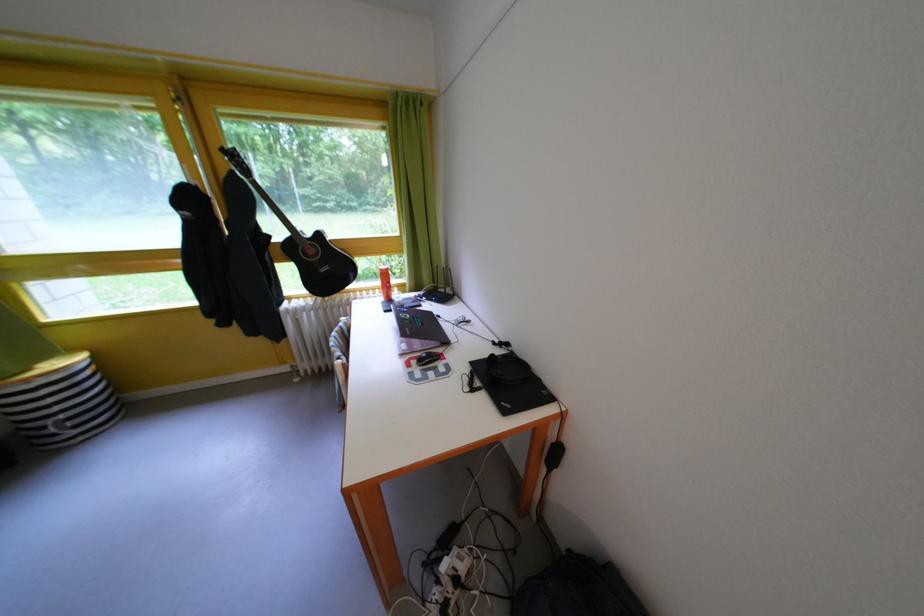
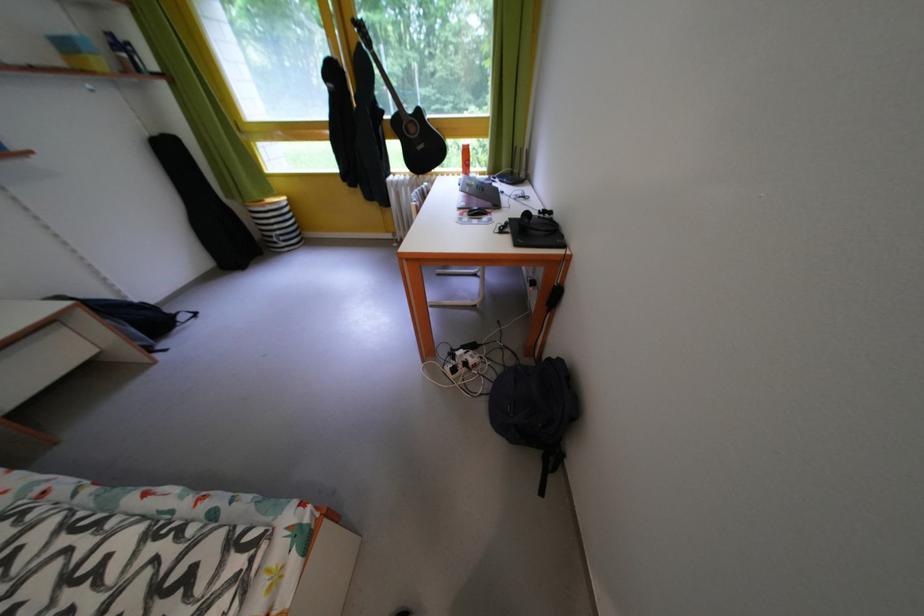
The point at (280,243) is marked in the first image. Where is the corresponding point in the second image?

(393, 118)